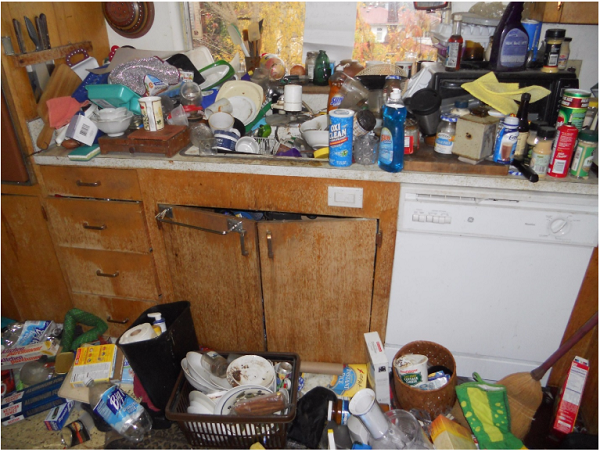
Identify the location of dish soap. This screenshot has width=600, height=452. (396, 126).